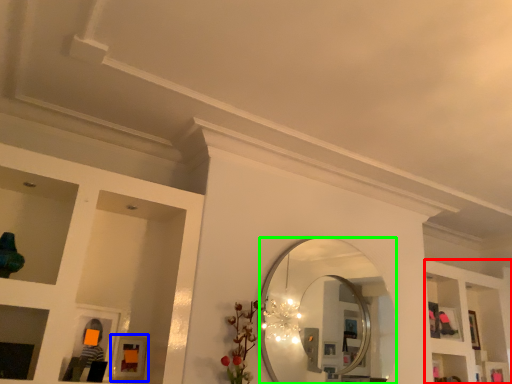
Question: Based on their relative distances, which object is farther from shelf (highlighted by a red box)? Choose from picture frame (highlighted by a blue box) and mirror (highlighted by a green box).

Choices:
 (A) picture frame
 (B) mirror

Answer: (A)